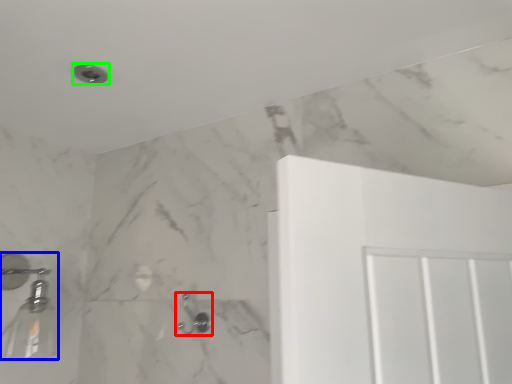
Question: Estimate the real-world distances between objects in this image. Which object is closer to shower (highlighted by a red box), shower (highlighted by a blue box) or shower (highlighted by a green box)?

Choices:
 (A) shower
 (B) shower

Answer: (A)